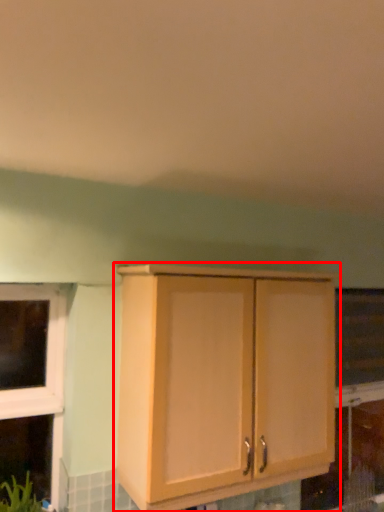
Question: From the image's perspective, where is cabinetry (annotated by the red box) located relative to window screen?

Choices:
 (A) below
 (B) above

Answer: (B)